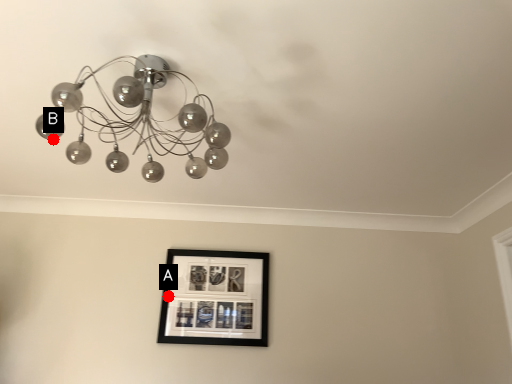
Question: Two points are circled on the image, labeled by A and B beside each circle. Among these points, which one is nearest to the camera?

Choices:
 (A) A is closer
 (B) B is closer

Answer: (B)